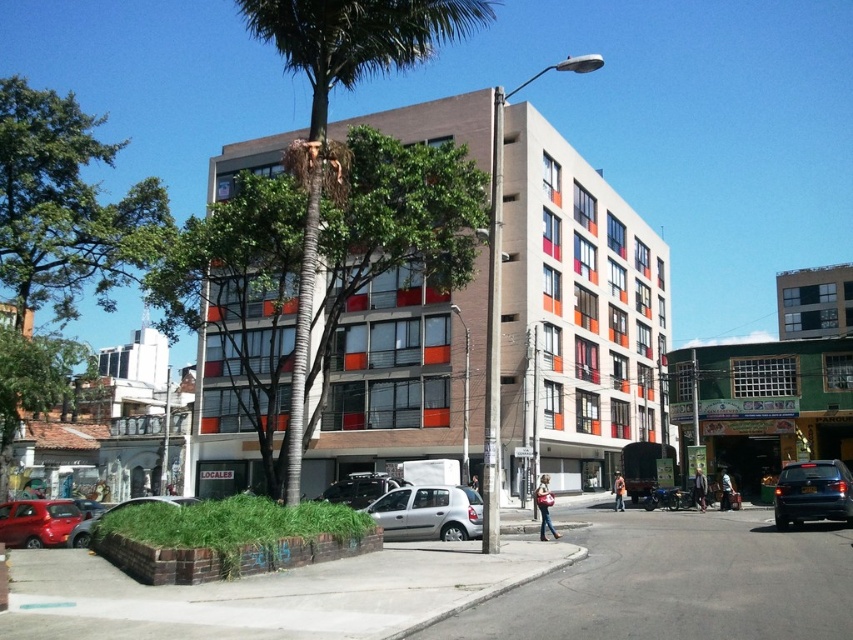
You are standing on the sidewalk in front of the building and want to take a photo of the green leafy tree at left. If your camera can focus on objects up to 20 meters away, will you be able to capture a clear photo of the tree?

The green leafy tree at left is 20.35 meters from camera, which is slightly beyond the camera focus range of 20 meters. Therefore, the camera may not capture a clear photo of the tree.

From the picture: You are a delivery person needing to park your silver metallic hatchback at center near the building. The parking spot is located at point (x=428, y=513). Can you safely park there without blocking the sidewalk?

The point (x=428, y=513) marks the silver metallic hatchback at center, so parking there would mean parking directly on the hatchback, which is not possible. Choose another spot.